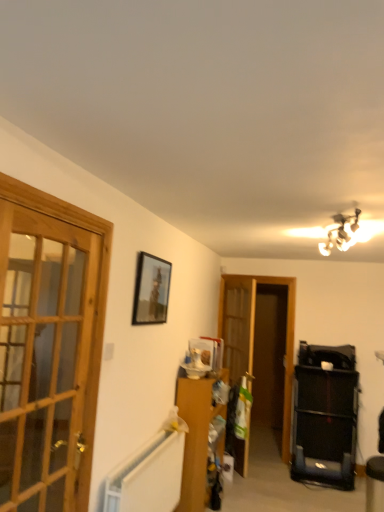
Question: Is wooden glass door at left taller than wooden cabinet at center?

Choices:
 (A) yes
 (B) no

Answer: (A)

Question: From the image's perspective, does wooden glass door at left appear lower than wooden cabinet at center?

Choices:
 (A) yes
 (B) no

Answer: (B)

Question: Considering the relative sizes of wooden glass door at left and wooden cabinet at center in the image provided, is wooden glass door at left shorter than wooden cabinet at center?

Choices:
 (A) no
 (B) yes

Answer: (A)

Question: Is wooden glass door at left positioned with its back to wooden cabinet at center?

Choices:
 (A) no
 (B) yes

Answer: (A)

Question: Is wooden glass door at left positioned in front of wooden cabinet at center?

Choices:
 (A) yes
 (B) no

Answer: (A)

Question: Is wooden glass door at left bigger than wooden cabinet at center?

Choices:
 (A) yes
 (B) no

Answer: (B)

Question: Is wooden cabinet at center shorter than metallic chandelier at upper right?

Choices:
 (A) yes
 (B) no

Answer: (B)

Question: Is wooden cabinet at center not inside metallic chandelier at upper right?

Choices:
 (A) yes
 (B) no

Answer: (A)

Question: Is wooden cabinet at center far from metallic chandelier at upper right?

Choices:
 (A) no
 (B) yes

Answer: (B)

Question: Is wooden cabinet at center at the left side of metallic chandelier at upper right?

Choices:
 (A) yes
 (B) no

Answer: (A)

Question: From the image's perspective, is wooden cabinet at center on top of metallic chandelier at upper right?

Choices:
 (A) yes
 (B) no

Answer: (B)

Question: From a real-world perspective, is wooden cabinet at center below metallic chandelier at upper right?

Choices:
 (A) no
 (B) yes

Answer: (B)

Question: Is metallic chandelier at upper right positioned in front of wooden cabinet at center?

Choices:
 (A) no
 (B) yes

Answer: (B)